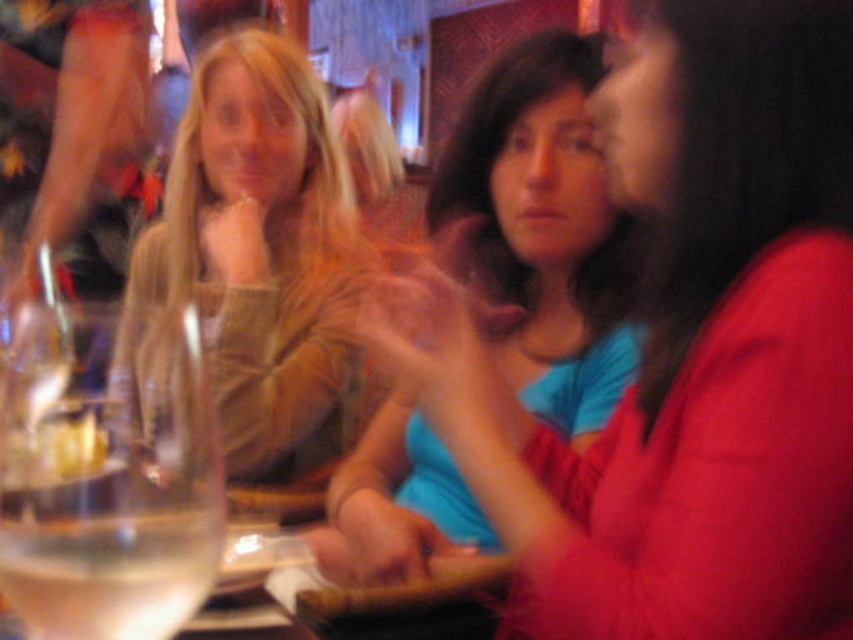
Question: Based on their relative distances, which object is farther from the matte blue shirt at center?

Choices:
 (A) clear glass at lower left
 (B) clear glass wine glass at left
 (C) matte brown sweater at center

Answer: (C)

Question: Among these objects, which one is nearest to the camera?

Choices:
 (A) clear glass at lower left
 (B) matte blue shirt at center
 (C) matte brown sweater at center

Answer: (A)

Question: Considering the real-world distances, which object is closest to the clear glass wine glass at left?

Choices:
 (A) matte brown sweater at center
 (B) matte blue shirt at center

Answer: (B)

Question: Does matte brown sweater at center lie in front of clear glass wine glass at left?

Choices:
 (A) yes
 (B) no

Answer: (B)

Question: From the image, what is the correct spatial relationship of matte blue shirt at center in relation to clear glass at lower left?

Choices:
 (A) right
 (B) left

Answer: (A)

Question: Does matte blue shirt at center have a larger size compared to matte brown sweater at center?

Choices:
 (A) yes
 (B) no

Answer: (B)